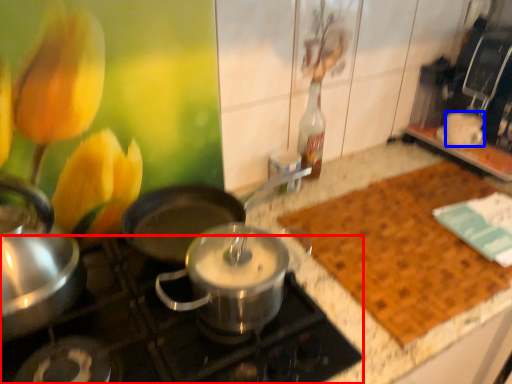
Question: Which object is further to the camera taking this photo, gas stove (highlighted by a red box) or coffee cup (highlighted by a blue box)?

Choices:
 (A) gas stove
 (B) coffee cup

Answer: (B)